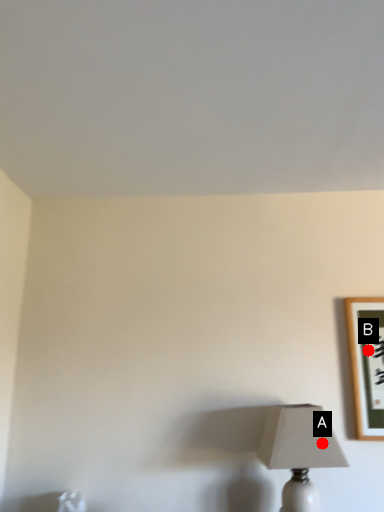
Question: Two points are circled on the image, labeled by A and B beside each circle. Which point is farther from the camera taking this photo?

Choices:
 (A) A is further
 (B) B is further

Answer: (B)